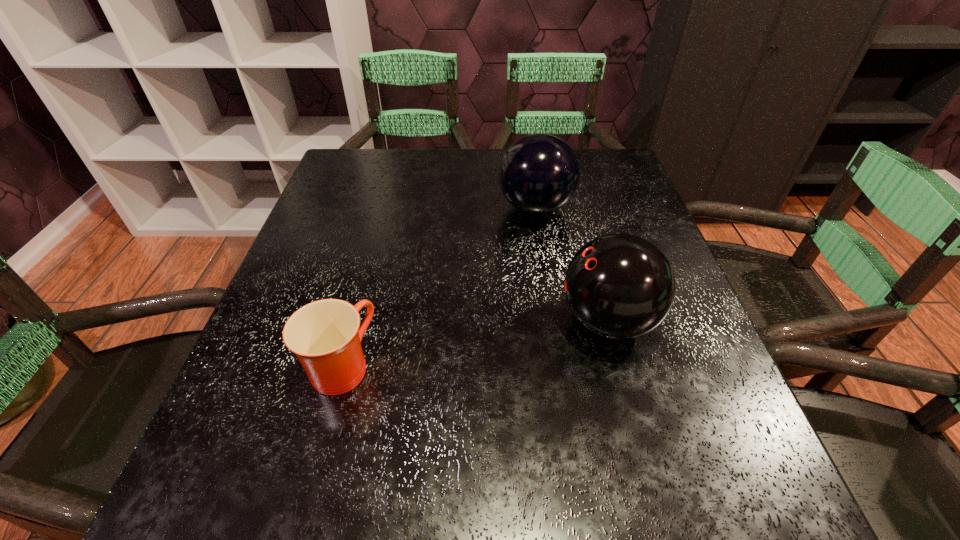
Locate an element on the screen. the farther bowling ball is located at coordinates [x=539, y=173].

At what (x,y) coordinates should I click in order to perform the action: click on the nearer bowling ball. Please return your answer as a coordinate pair (x, y). The height and width of the screenshot is (540, 960). Looking at the image, I should click on (620, 286).

Locate an element on the screen. cup is located at coordinates (325, 335).

At what (x,y) coordinates should I click in order to perform the action: click on the shortest object. Please return your answer as a coordinate pair (x, y). This screenshot has width=960, height=540. Looking at the image, I should click on (325, 335).

I want to click on vacant area located on the side of the farther bowling ball with the finger holes, so click(x=385, y=208).

The image size is (960, 540). Identify the location of vacant area situated on the side of the farther bowling ball with the finger holes. (406, 208).

At what (x,y) coordinates should I click in order to perform the action: click on vacant region located on the side of the farther bowling ball with the finger holes. Please return your answer as a coordinate pair (x, y). The width and height of the screenshot is (960, 540). Looking at the image, I should click on (361, 208).

The width and height of the screenshot is (960, 540). Find the location of `free space located 0.340m on the surface of the nearer bowling ball near the finger holes`. free space located 0.340m on the surface of the nearer bowling ball near the finger holes is located at coordinates (373, 321).

The height and width of the screenshot is (540, 960). Find the location of `vacant space positioned on the surface of the nearer bowling ball near the finger holes`. vacant space positioned on the surface of the nearer bowling ball near the finger holes is located at coordinates (357, 321).

Where is `free region located on the surface of the nearer bowling ball near the finger holes`? free region located on the surface of the nearer bowling ball near the finger holes is located at coordinates 499,321.